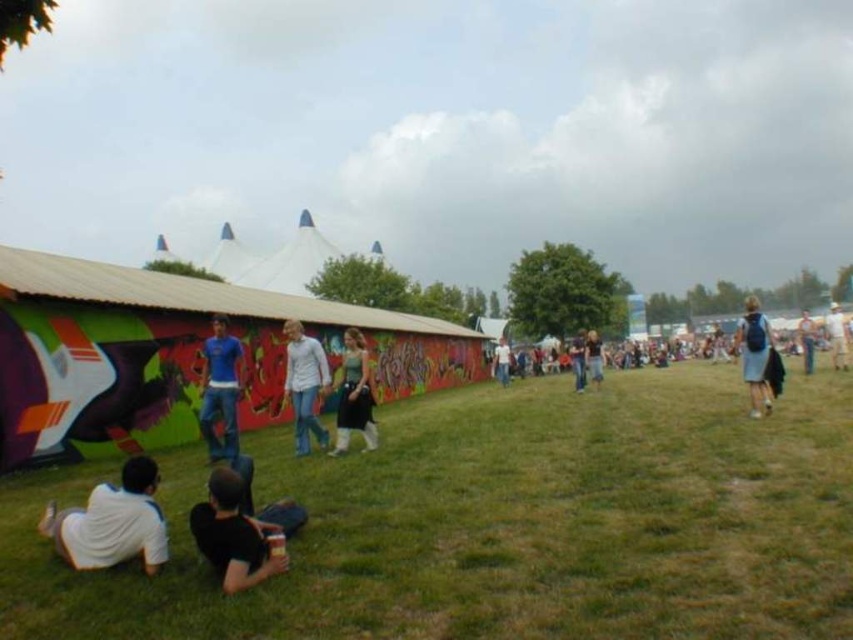
You are standing at the center of the field looking towards the large colorful structure with graffiti. Where would you see the white matte shirt at lower left relative to your position?

The white matte shirt at lower left is located at the lower left position relative to your viewpoint, which corresponds to the coordinates point (112, 522) in the image.

Consider the image. You are at the festival and want to place your blue backpack at right on the ground next to your white cotton shirt at center. Considering their sizes, which item will take up more space?

The white cotton shirt at center takes up more space than the blue backpack at right because the blue backpack at right has a smaller size compared to white cotton shirt at center.

You are standing at the festival and want to take a photo of the two points mentioned. Which point is closer to you, point (320, 355) or point (833, 362)?

Point (320, 355) is in front of point (833, 362), so it is closer to you.